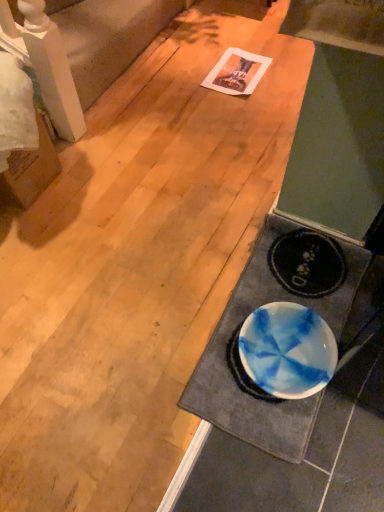
What do you see at coordinates (230, 371) in the screenshot?
I see `white glossy bowl at lower right` at bounding box center [230, 371].

Find the location of `white glossy bowl at lower right`. white glossy bowl at lower right is located at coordinates (230, 371).

Find the location of a particular element. This screenshot has height=512, width=384. white glossy bowl at lower right is located at coordinates (230, 371).